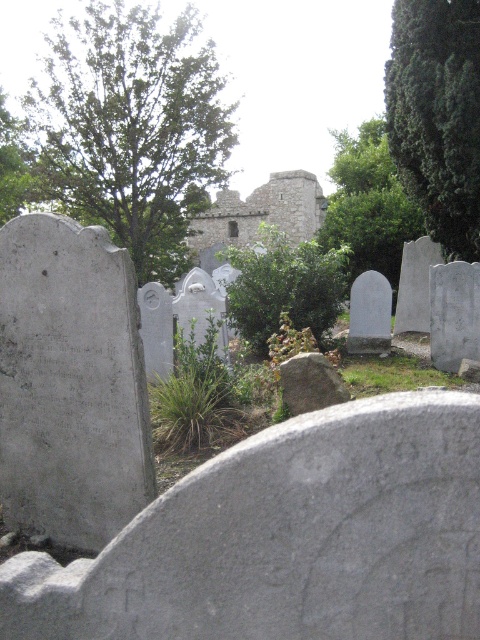
You are standing at the entrance of the cemetery and see the green leafy tree at upper left and the green leafy tree at center. Which tree is closer to you?

The green leafy tree at upper left is closer to you because it is in front of the green leafy tree at center.